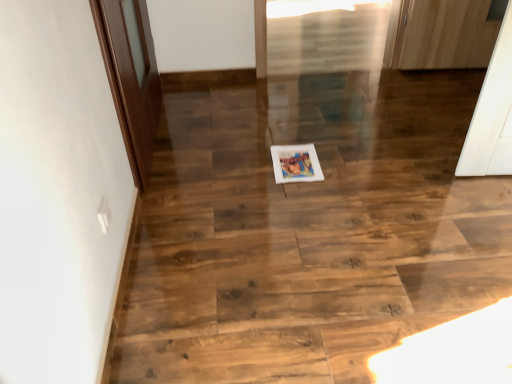
At what (x,y) coordinates should I click in order to perform the action: click on spots to the right of brown wooden door at left. Please return your answer as a coordinate pair (x, y). The image size is (512, 384). Looking at the image, I should click on (249, 131).